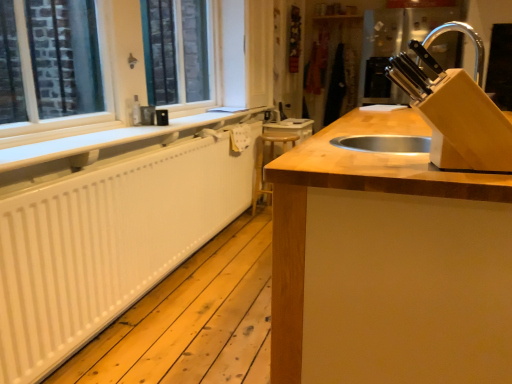
Find the location of a particular element. vacant space that is in between wooden at center and white matte radiator at left is located at coordinates (201, 276).